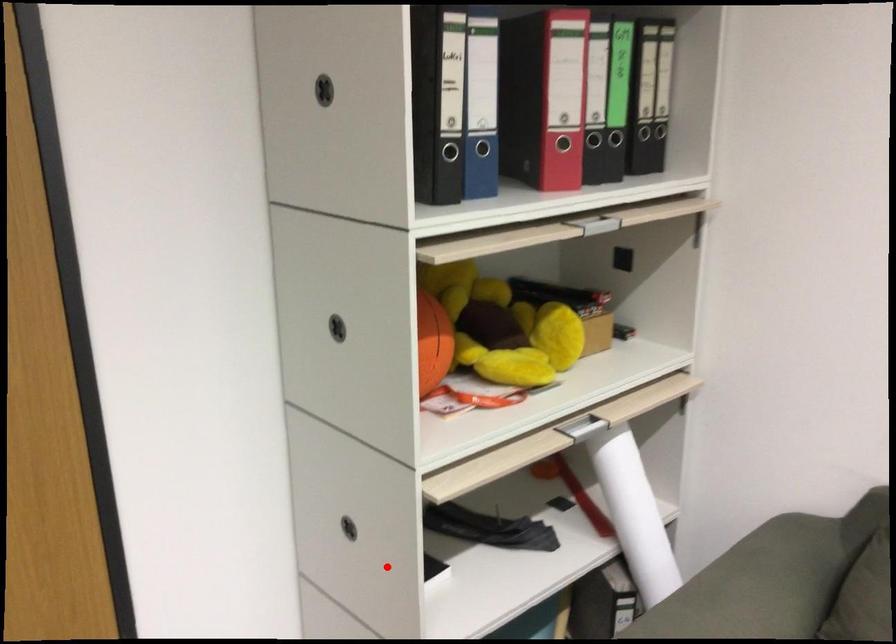
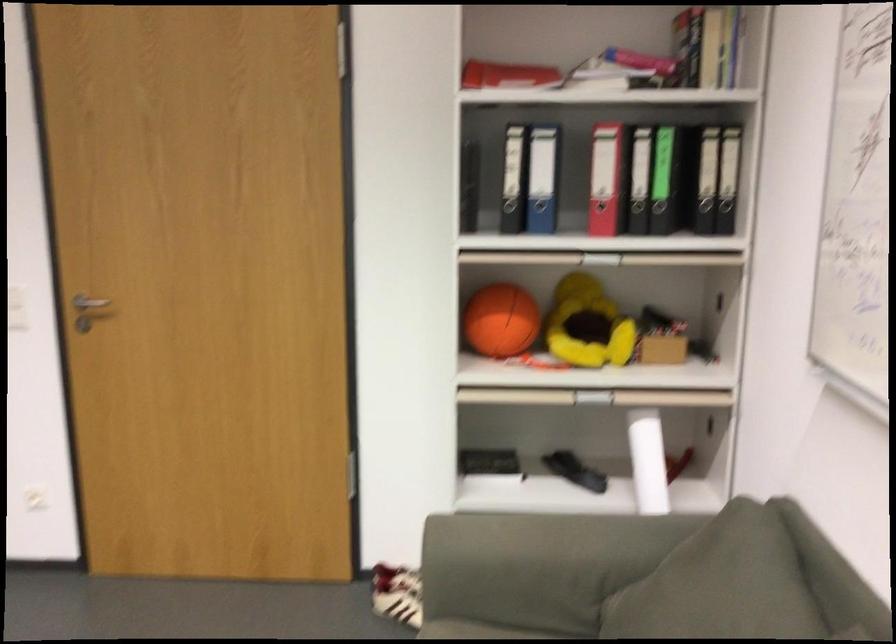
Locate, in the second image, the point that corresponds to the highlighted location in the first image.

(489, 464)